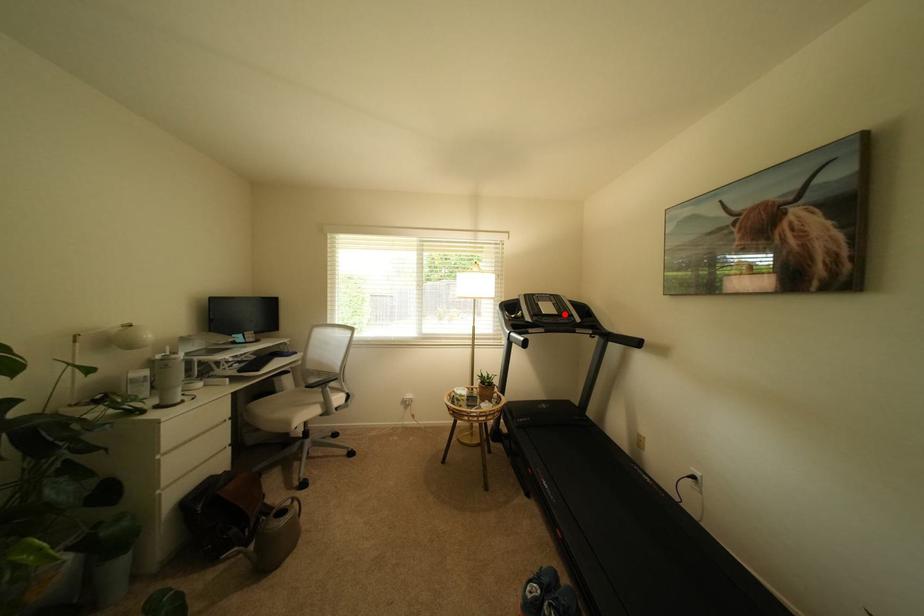
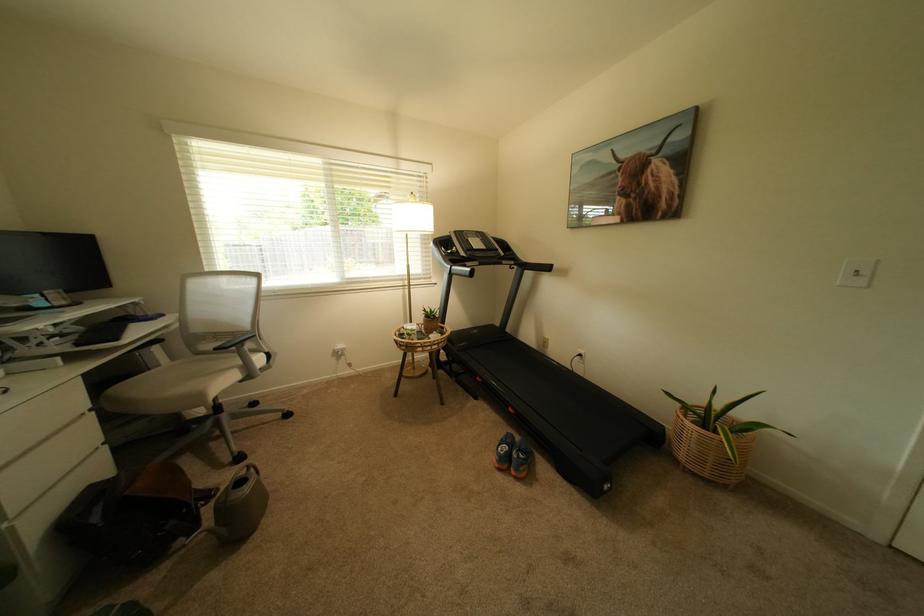
Question: I am providing you with two images of the same scene from different viewpoints. Given a red point in image1, look at the same physical point in image2. Is it:

Choices:
 (A) Closer to the viewpoint
 (B) Farther from the viewpoint

Answer: (A)